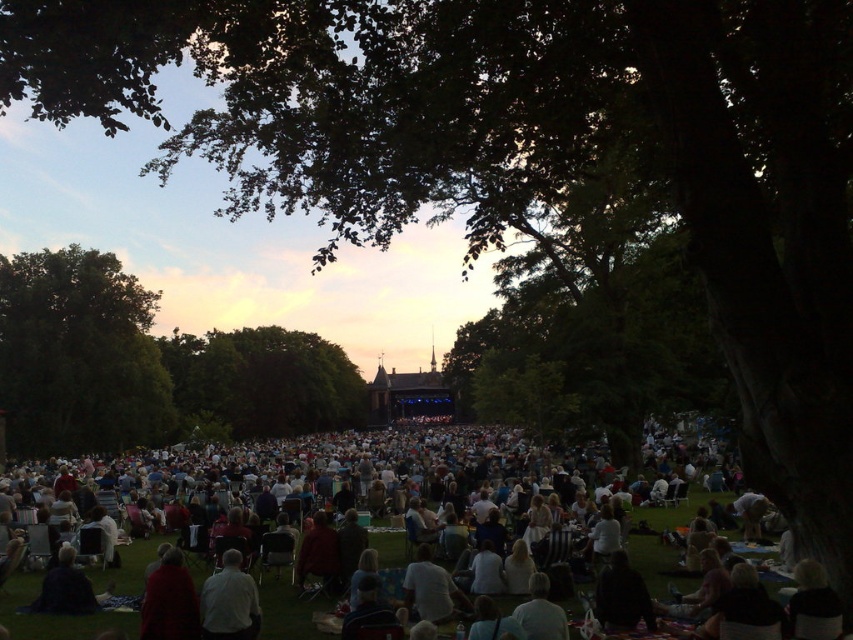
You are at the outdoor event and want to find a spot under the trees for shade. Which tree, the green leafy tree at left or the green leafy tree at center, is located more to the left side?

The green leafy tree at left is positioned on the left side of the green leafy tree at center, so it is more to the left.

You are attending an outdoor event and want to sit on the light beige fabric blanket at center. Based on the coordinates provided, where exactly should you go to find it?

The light beige fabric blanket at center is located at coordinates point (322,460).

You are at the event and want to take a photo of the green leafy tree at center without the light beige fabric blanket at center blocking the view. Where should you position yourself relative to the blanket and tree?

You should move behind the light beige fabric blanket at center so that it is between you and the green leafy tree at center, allowing you to see the tree without obstruction.